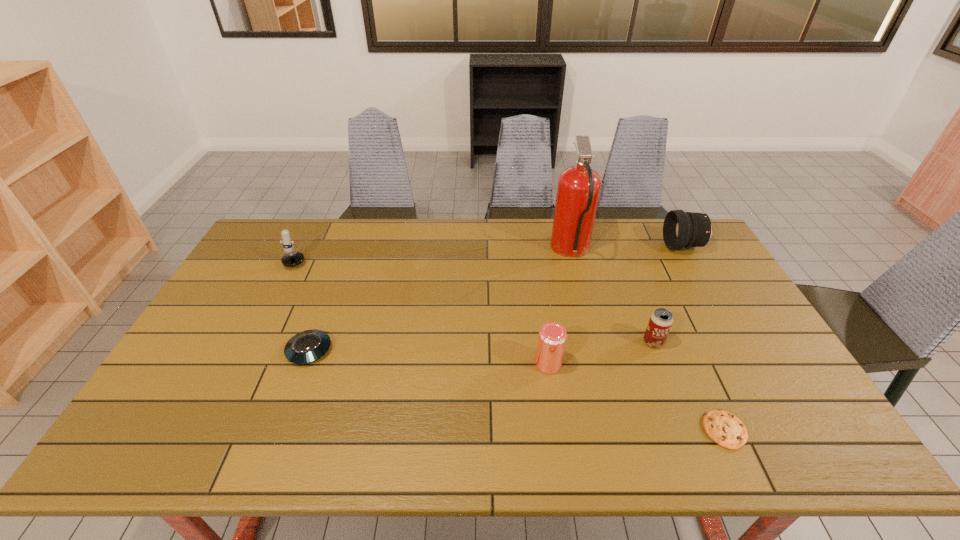
This screenshot has height=540, width=960. Identify the location of free space located on the back of the right beer can. (629, 279).

Image resolution: width=960 pixels, height=540 pixels. Find the location of `free space located 0.060m on the left of the saucer`. free space located 0.060m on the left of the saucer is located at coordinates (265, 350).

The image size is (960, 540). I want to click on vacant point located on the back of the cookie, so click(666, 302).

I want to click on fire extinguisher that is at the far edge, so click(578, 191).

In order to click on telephoto lens that is at the far edge in this screenshot , I will do `click(681, 229)`.

Locate an element on the screen. microphone located at the far edge is located at coordinates (293, 258).

Image resolution: width=960 pixels, height=540 pixels. Identify the location of object situated at the near edge. (724, 428).

Locate an element on the screen. This screenshot has width=960, height=540. object present at the left edge is located at coordinates (x=293, y=258).

This screenshot has height=540, width=960. What are the coordinates of `object at the right edge` in the screenshot? It's located at (681, 229).

Find the location of a particular element. This screenshot has width=960, height=540. object located at the far left corner is located at coordinates (x=293, y=258).